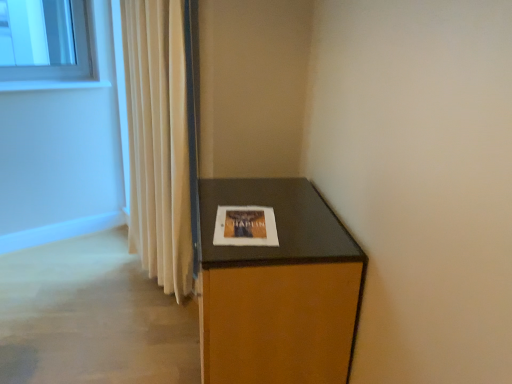
What do you see at coordinates (278, 288) in the screenshot?
I see `brown wood cabinet at lower right` at bounding box center [278, 288].

The width and height of the screenshot is (512, 384). Describe the element at coordinates (158, 141) in the screenshot. I see `beige fabric curtain at left` at that location.

Describe the element at coordinates (52, 85) in the screenshot. I see `white glossy window sill at upper left` at that location.

Locate an element on the screen. The image size is (512, 384). brown wood cabinet at lower right is located at coordinates (278, 288).

Between point (354, 319) and point (153, 22), which one is positioned behind?

Point (153, 22)

How many degrees apart are the facing directions of brown wood cabinet at lower right and beige fabric curtain at left?

brown wood cabinet at lower right and beige fabric curtain at left are facing 27.6 degrees away from each other.

Based on their sizes in the image, would you say brown wood cabinet at lower right is bigger or smaller than beige fabric curtain at left?

In the image, brown wood cabinet at lower right appears to be larger than beige fabric curtain at left.

Is brown wood cabinet at lower right far from beige fabric curtain at left?

No, brown wood cabinet at lower right is not far away from beige fabric curtain at left.

This screenshot has height=384, width=512. In order to click on furniture lying on the right of white glossy window sill at upper left in this screenshot , I will do `click(278, 288)`.

From the image's perspective, between brown wood cabinet at lower right and white glossy window sill at upper left, who is located below?

brown wood cabinet at lower right, from the image's perspective.

Consider the image. Can you confirm if brown wood cabinet at lower right is positioned to the left of white glossy window sill at upper left?

Incorrect, brown wood cabinet at lower right is not on the left side of white glossy window sill at upper left.

Which point is more forward, (263,208) or (290,229)?

The point (290,229) is more forward.

Is matte white picture frame at center shorter than brown wood cabinet at lower right?

Correct, matte white picture frame at center is not as tall as brown wood cabinet at lower right.

Is brown wood cabinet at lower right surrounded by matte white picture frame at center?

That's incorrect, brown wood cabinet at lower right is not inside matte white picture frame at center.

Is there a large distance between matte white picture frame at center and brown wood cabinet at lower right?

matte white picture frame at center is actually quite close to brown wood cabinet at lower right.

Which of these two, white glossy window sill at upper left or matte white picture frame at center, stands taller?

white glossy window sill at upper left is taller.

Is point (91, 83) farther from viewer compared to point (260, 225)?

Yes, it is behind point (260, 225).

Can you tell me how much white glossy window sill at upper left and matte white picture frame at center differ in facing direction?

There is a 124-degree angle between the facing directions of white glossy window sill at upper left and matte white picture frame at center.

From their relative heights in the image, would you say white glossy window sill at upper left is taller or shorter than beige fabric curtain at left?

white glossy window sill at upper left is shorter than beige fabric curtain at left.

Considering the relative positions of white glossy window sill at upper left and beige fabric curtain at left in the image provided, is white glossy window sill at upper left to the right of beige fabric curtain at left from the viewer's perspective?

No.

Does white glossy window sill at upper left turn towards beige fabric curtain at left?

No, white glossy window sill at upper left is not oriented towards beige fabric curtain at left.

In terms of size, does white glossy window sill at upper left appear bigger or smaller than beige fabric curtain at left?

In the image, white glossy window sill at upper left appears to be smaller than beige fabric curtain at left.

Is beige fabric curtain at left not inside matte white picture frame at center?

beige fabric curtain at left lies outside matte white picture frame at center's area.

At what (x,y) coordinates should I click in order to perform the action: click on curtain below the matte white picture frame at center (from a real-world perspective). Please return your answer as a coordinate pair (x, y). This screenshot has height=384, width=512. Looking at the image, I should click on (158, 141).

From a real-world perspective, between beige fabric curtain at left and matte white picture frame at center, who is vertically higher?

matte white picture frame at center.

From the image's perspective, between beige fabric curtain at left and matte white picture frame at center, which one is located above?

beige fabric curtain at left, from the image's perspective.

Is beige fabric curtain at left situated inside white glossy window sill at upper left or outside?

beige fabric curtain at left is not enclosed by white glossy window sill at upper left.

Looking at this image, considering the relative sizes of beige fabric curtain at left and white glossy window sill at upper left in the image provided, is beige fabric curtain at left taller than white glossy window sill at upper left?

Yes.

Visually, is beige fabric curtain at left positioned to the left or to the right of white glossy window sill at upper left?

Based on their positions, beige fabric curtain at left is located to the right of white glossy window sill at upper left.

From the image's perspective, is beige fabric curtain at left above white glossy window sill at upper left?

No, from the image's perspective, beige fabric curtain at left is not over white glossy window sill at upper left.

This screenshot has height=384, width=512. I want to click on curtain above the brown wood cabinet at lower right (from a real-world perspective), so click(x=158, y=141).

Find the location of a particular element. The width and height of the screenshot is (512, 384). furniture that is below the white glossy window sill at upper left (from the image's perspective) is located at coordinates (278, 288).

Looking at the image, which one is located closer to brown wood cabinet at lower right, beige fabric curtain at left or white glossy window sill at upper left?

Based on the image, beige fabric curtain at left appears to be nearer to brown wood cabinet at lower right.

Based on their spatial positions, is beige fabric curtain at left or brown wood cabinet at lower right closer to matte white picture frame at center?

The object closer to matte white picture frame at center is brown wood cabinet at lower right.

Which object lies further to the anchor point white glossy window sill at upper left, beige fabric curtain at left or brown wood cabinet at lower right?

The object further to white glossy window sill at upper left is brown wood cabinet at lower right.

Estimate the real-world distances between objects in this image. Which object is further from brown wood cabinet at lower right, matte white picture frame at center or beige fabric curtain at left?

beige fabric curtain at left is further to brown wood cabinet at lower right.

Which object lies nearer to the anchor point beige fabric curtain at left, brown wood cabinet at lower right or matte white picture frame at center?

brown wood cabinet at lower right is positioned closer to the anchor beige fabric curtain at left.

Estimate the real-world distances between objects in this image. Which object is further from brown wood cabinet at lower right, white glossy window sill at upper left or matte white picture frame at center?

Based on the image, white glossy window sill at upper left appears to be further to brown wood cabinet at lower right.

Considering their positions, is white glossy window sill at upper left positioned closer to matte white picture frame at center than beige fabric curtain at left?

The object closer to matte white picture frame at center is beige fabric curtain at left.

Which object lies nearer to the anchor point white glossy window sill at upper left, brown wood cabinet at lower right or matte white picture frame at center?

matte white picture frame at center is closer to white glossy window sill at upper left.

This screenshot has height=384, width=512. I want to click on picture frame between white glossy window sill at upper left and brown wood cabinet at lower right from left to right, so click(245, 226).

At what (x,y) coordinates should I click in order to perform the action: click on curtain located between white glossy window sill at upper left and brown wood cabinet at lower right in the left-right direction. Please return your answer as a coordinate pair (x, y). Looking at the image, I should click on (158, 141).

Identify the location of curtain between white glossy window sill at upper left and matte white picture frame at center in the horizontal direction. Image resolution: width=512 pixels, height=384 pixels. (158, 141).

This screenshot has height=384, width=512. What are the coordinates of `picture frame between beige fabric curtain at left and brown wood cabinet at lower right in the vertical direction` in the screenshot? It's located at (245, 226).